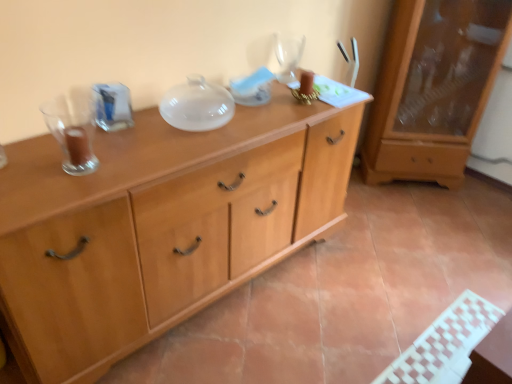
The image size is (512, 384). I want to click on free space above light wood cabinet at center (from a real-world perspective), so click(x=150, y=133).